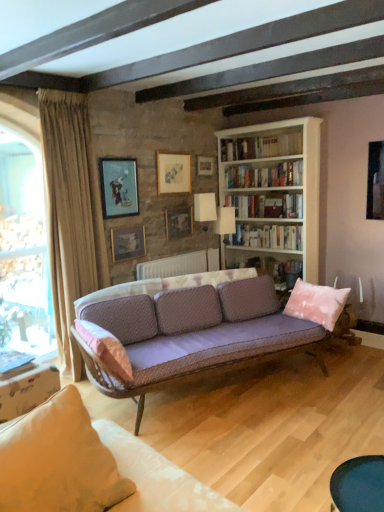
This screenshot has width=384, height=512. Identify the location of pink velvet swivel chair at right. (344, 329).

This screenshot has width=384, height=512. What do you see at coordinates (261, 146) in the screenshot?
I see `white glossy bookshelf at upper center, marked as the first book in a top-to-bottom arrangement` at bounding box center [261, 146].

What do you see at coordinates (265, 175) in the screenshot?
I see `hardcover books at center, the 4th book in the bottom-to-top sequence` at bounding box center [265, 175].

Identify the location of pink fabric radiator at center. This screenshot has height=512, width=384. (179, 265).

Describe the element at coordinates (270, 267) in the screenshot. The height and width of the screenshot is (512, 384). I see `pink fabric bookshelf at center` at that location.

Describe the element at coordinates (173, 173) in the screenshot. I see `matte gold picture frame at upper center, which ranks as the 3th picture frame in left-to-right order` at that location.

Find the location of a particular element. beige curtain at left is located at coordinates (23, 247).

Is white fabric lampshade at center closer to the viewer compared to hardcover book at lower left, which is counted as the fifth book, starting from the top?

No, it is not.

Identify the location of lamp above the hardcover book at lower left, which is counted as the fifth book, starting from the top (from the image's perspective). (225, 221).

Consider the image. Does white fabric lampshade at center appear on the left side of hardcover book at lower left, which is counted as the fifth book, starting from the top?

No, white fabric lampshade at center is not to the left of hardcover book at lower left, which is counted as the fifth book, starting from the top.

Between point (224, 222) and point (5, 372), which one is positioned behind?

Point (224, 222)

Can you tell me how much matte gold picture frame at upper center, arranged as the 3th picture frame when viewed from the right, and hardcover book at lower left, which is the first book in bottom-to-top order, differ in facing direction?

The facing directions of matte gold picture frame at upper center, arranged as the 3th picture frame when viewed from the right, and hardcover book at lower left, which is the first book in bottom-to-top order, are 2.51 degrees apart.

Where is `book on the left of matte gold picture frame at upper center, which ranks as the 3th picture frame in left-to-right order`? book on the left of matte gold picture frame at upper center, which ranks as the 3th picture frame in left-to-right order is located at coordinates (13, 360).

Is matte gold picture frame at upper center, which ranks as the 3th picture frame in left-to-right order, not near hardcover book at lower left, which is counted as the fifth book, starting from the top?

matte gold picture frame at upper center, which ranks as the 3th picture frame in left-to-right order, is far away from hardcover book at lower left, which is counted as the fifth book, starting from the top.

Which point is more forward, (169, 184) or (2, 369)?

The point (2, 369) is closer to the camera.

Is white paper bookshelf at upper center, which appears as the 4th book when viewed from the top, inside or outside of hardcover books at center, the 4th book in the bottom-to-top sequence?

white paper bookshelf at upper center, which appears as the 4th book when viewed from the top, is located beyond the bounds of hardcover books at center, the 4th book in the bottom-to-top sequence.

From the picture: Does white paper bookshelf at upper center, which is counted as the 2th book, starting from the bottom, lie in front of hardcover books at center, acting as the 2th book starting from the top?

That is False.

Can you confirm if white paper bookshelf at upper center, which appears as the 4th book when viewed from the top, is bigger than hardcover books at center, acting as the 2th book starting from the top?

Correct, white paper bookshelf at upper center, which appears as the 4th book when viewed from the top, is larger in size than hardcover books at center, acting as the 2th book starting from the top.

Could you tell me if white paper bookshelf at upper center, which is counted as the 2th book, starting from the bottom, is facing hardcover books at center, the 4th book in the bottom-to-top sequence?

No, white paper bookshelf at upper center, which is counted as the 2th book, starting from the bottom, is not oriented towards hardcover books at center, the 4th book in the bottom-to-top sequence.

I want to click on the 4th book above the smooth dark blue table at lower right, which appears as the second table when viewed from the left (from the image's perspective), so click(x=265, y=175).

Which is more to the left, hardcover books at center, the 4th book in the bottom-to-top sequence, or smooth dark blue table at lower right, which appears as the second table when viewed from the left?

smooth dark blue table at lower right, which appears as the second table when viewed from the left, is more to the left.

Does hardcover books at center, the 4th book in the bottom-to-top sequence, have a lesser width compared to smooth dark blue table at lower right, the second table from the back?

Yes, hardcover books at center, the 4th book in the bottom-to-top sequence, is thinner than smooth dark blue table at lower right, the second table from the back.

Is matte gold picture frame at center, which is the 2th picture frame from left to right, facing away from matte blue painting at upper left, positioned as the 5th picture frame in right-to-left order?

No.

What's the angular difference between matte gold picture frame at center, which is the 2th picture frame from left to right, and matte blue painting at upper left, the 1th picture frame viewed from the left,'s facing directions?

matte gold picture frame at center, which is the 2th picture frame from left to right, and matte blue painting at upper left, the 1th picture frame viewed from the left, are facing 0.0807 degrees away from each other.

Does matte gold picture frame at center, which is the 2th picture frame from left to right, have a lesser height compared to matte blue painting at upper left, positioned as the 5th picture frame in right-to-left order?

Yes.

Is matte gold picture frame at center, placed as the 4th picture frame when sorted from right to left, bigger than matte blue painting at upper left, the 1th picture frame viewed from the left?

No, matte gold picture frame at center, placed as the 4th picture frame when sorted from right to left, is not bigger than matte blue painting at upper left, the 1th picture frame viewed from the left.

Considering the sizes of objects white glossy bookshelf at upper center, marked as the first book in a top-to-bottom arrangement, and beige fabric pillow at lower left, which is the 2th pillow from right to left, in the image provided, who is shorter, white glossy bookshelf at upper center, marked as the first book in a top-to-bottom arrangement, or beige fabric pillow at lower left, which is the 2th pillow from right to left,?

Standing shorter between the two is white glossy bookshelf at upper center, marked as the first book in a top-to-bottom arrangement.

Who is more distant, white glossy bookshelf at upper center, the 5th book when ordered from bottom to top, or beige fabric pillow at lower left, arranged as the 1th pillow when viewed from the front?

Positioned behind is white glossy bookshelf at upper center, the 5th book when ordered from bottom to top.

From the image's perspective, relative to beige fabric pillow at lower left, arranged as the 1th pillow when viewed from the front, is white glossy bookshelf at upper center, the 5th book when ordered from bottom to top, above or below?

Clearly, from the image's perspective, white glossy bookshelf at upper center, the 5th book when ordered from bottom to top, is above beige fabric pillow at lower left, arranged as the 1th pillow when viewed from the front.

Does point (290, 260) lie behind point (16, 323)?

Yes, point (290, 260) is behind point (16, 323).

Is white wooden bookcase at upper center aimed at beige curtain at left?

Yes.

What's the angular difference between white wooden bookcase at upper center and beige curtain at left's facing directions?

They differ by 90.3 degrees in their facing directions.

Locate an element on the screen. book that appears in front of the white fabric lampshade at center is located at coordinates (13, 360).

Locate an element on the screen. The height and width of the screenshot is (512, 384). the 4th book positioned below the matte gold picture frame at upper center, which ranks as the 3th picture frame in left-to-right order (from a real-world perspective) is located at coordinates (13, 360).

Looking at the image, which one is located further to white glossy bookshelf at upper center, marked as the first book in a top-to-bottom arrangement, hardcover book at center, which appears as the 3th book when ordered from the bottom, or matte gold picture frame at upper center, arranged as the 3th picture frame when viewed from the right?

matte gold picture frame at upper center, arranged as the 3th picture frame when viewed from the right, lies further to white glossy bookshelf at upper center, marked as the first book in a top-to-bottom arrangement, than the other object.

Looking at the image, which one is located further to wooden picture frame at upper center, arranged as the first picture frame when viewed from the right, pink fabric bookshelf at center or matte blue painting at upper left, positioned as the 5th picture frame in right-to-left order?

pink fabric bookshelf at center lies further to wooden picture frame at upper center, arranged as the first picture frame when viewed from the right, than the other object.

From the image, which object appears to be nearer to hardcover book at center, which appears as the 3th book when ordered from the bottom, white fabric lampshade at center or beige fabric pillow at lower left, arranged as the 1th pillow when viewed from the front?

white fabric lampshade at center lies closer to hardcover book at center, which appears as the 3th book when ordered from the bottom, than the other object.

Based on their spatial positions, is white glossy bookshelf at upper center, the 5th book when ordered from bottom to top, or wooden picture frame at upper center, which ranks as the 5th picture frame in left-to-right order, closer to pink velvet swivel chair at right?

white glossy bookshelf at upper center, the 5th book when ordered from bottom to top, is positioned closer to the anchor pink velvet swivel chair at right.

Estimate the real-world distances between objects in this image. Which object is further from wooden picture frame at upper center, arranged as the first picture frame when viewed from the right, beige fabric curtain at left or white wooden bookcase at upper center?

beige fabric curtain at left lies further to wooden picture frame at upper center, arranged as the first picture frame when viewed from the right, than the other object.

Which object lies nearer to the anchor point wooden picture frame at upper center, which is the second picture frame from right to left, smooth dark blue table at lower right, which appears as the second table when viewed from the left, or beige fabric pillow at lower left, which is the 2th pillow from right to left?

Based on the image, beige fabric pillow at lower left, which is the 2th pillow from right to left, appears to be nearer to wooden picture frame at upper center, which is the second picture frame from right to left.

From the image, which object appears to be nearer to wooden picture frame at upper center, arranged as the first picture frame when viewed from the right, white fabric lampshade at center or hardcover book at lower left, which is the first book in bottom-to-top order?

white fabric lampshade at center.

Which object lies nearer to the anchor point hardcover books at center, the 4th book in the bottom-to-top sequence, pink fabric radiator at center or smooth dark blue table at lower right, which appears as the second table when viewed from the left?

pink fabric radiator at center lies closer to hardcover books at center, the 4th book in the bottom-to-top sequence, than the other object.

Locate an element on the screen. pillow between beige fabric pillow at lower left, arranged as the 1th pillow when viewed from the front, and pink fabric bookshelf at center from front to back is located at coordinates (316, 303).

This screenshot has height=512, width=384. What are the coordinates of `lamp situated between wooden table at lower left, the second table in the front-to-back sequence, and hardcover books at center, the 4th book in the bottom-to-top sequence, from left to right` in the screenshot? It's located at (225, 221).

I want to click on book positioned between smooth dark blue table at lower right, which appears as the second table when viewed from the left, and matte gold picture frame at upper center, which ranks as the 3th picture frame in left-to-right order, from near to far, so click(x=13, y=360).

In order to click on bookcase located between wooden table at lower left, marked as the first table in a left-to-right arrangement, and white paper bookshelf at upper center, which is counted as the 2th book, starting from the bottom, in the left-right direction in this screenshot , I will do `click(272, 195)`.